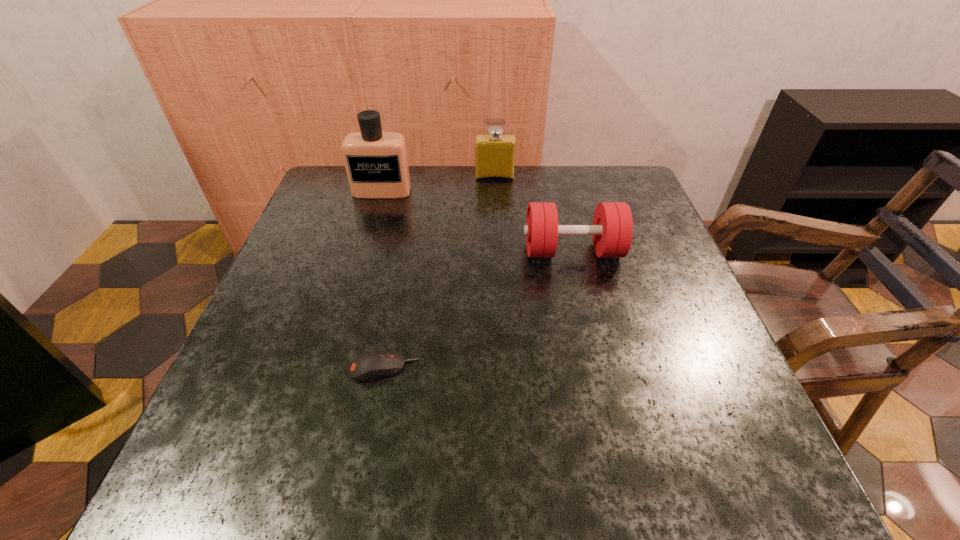
At what (x,y) coordinates should I click in order to perform the action: click on vacant space at the far right corner of the desktop. Please return your answer as a coordinate pair (x, y). Looking at the image, I should click on (590, 200).

This screenshot has width=960, height=540. In order to click on free space between the left perfume and the nearest object in this screenshot , I will do `click(383, 280)`.

Where is `empty space between the nearer perfume and the right perfume`? empty space between the nearer perfume and the right perfume is located at coordinates (438, 184).

You are a GUI agent. You are given a task and a screenshot of the screen. Output one action in this format:
    pyautogui.click(x=<x>, y=<y>)
    Task: Click on the vacant area that lies between the nearest object and the taller perfume
    This screenshot has width=960, height=540.
    Given the screenshot: What is the action you would take?
    pyautogui.click(x=383, y=280)

This screenshot has height=540, width=960. In order to click on free space between the second shortest object and the left perfume in this screenshot , I will do `click(477, 221)`.

The height and width of the screenshot is (540, 960). I want to click on free point between the second shortest object and the nearest object, so click(478, 309).

Locate an element on the screen. vacant space that's between the left perfume and the third tallest object is located at coordinates (477, 221).

I want to click on vacant space in between the rightmost object and the taller perfume, so click(x=477, y=221).

Locate an element on the screen. The image size is (960, 540). unoccupied position between the nearest object and the rightmost object is located at coordinates (478, 309).

At what (x,y) coordinates should I click in order to perform the action: click on free spot between the farthest object and the taller perfume. Please return your answer as a coordinate pair (x, y). Looking at the image, I should click on (438, 184).